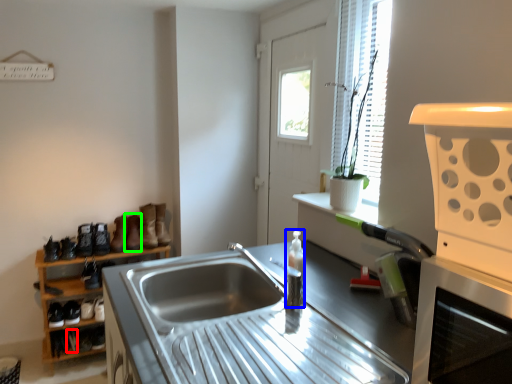
Question: Which object is positioned farthest from shoe (highlighted by a red box)? Select from bottle (highlighted by a blue box) and boot (highlighted by a green box).

Choices:
 (A) bottle
 (B) boot

Answer: (A)